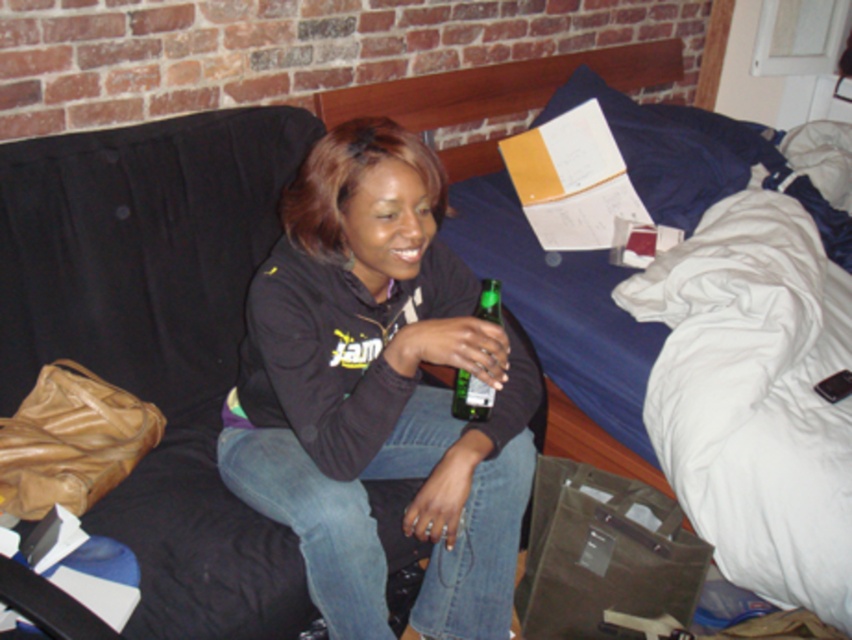
Question: Among these objects, which one is farthest from the camera?

Choices:
 (A) green glass bottle at center
 (B) black matte sweatshirt at center
 (C) blue fabric bed at upper center

Answer: (C)

Question: Does blue fabric bed at upper center appear over green glass bottle at center?

Choices:
 (A) yes
 (B) no

Answer: (A)

Question: Which object is the closest to the green glass bottle at center?

Choices:
 (A) black matte sweatshirt at center
 (B) blue fabric bed at upper center

Answer: (A)

Question: Among these points, which one is farthest from the camera?

Choices:
 (A) (487, 396)
 (B) (407, 92)

Answer: (B)

Question: Is black matte sweatshirt at center smaller than blue fabric bed at upper center?

Choices:
 (A) no
 (B) yes

Answer: (B)

Question: Is black matte sweatshirt at center to the left of green glass bottle at center from the viewer's perspective?

Choices:
 (A) yes
 (B) no

Answer: (A)